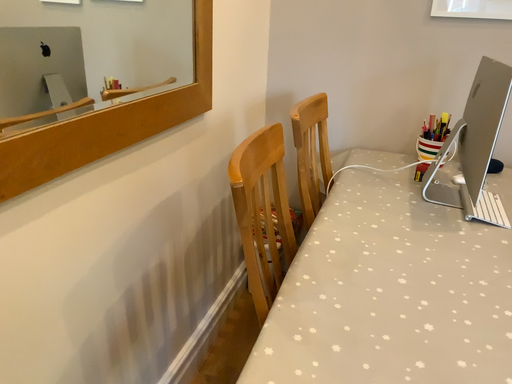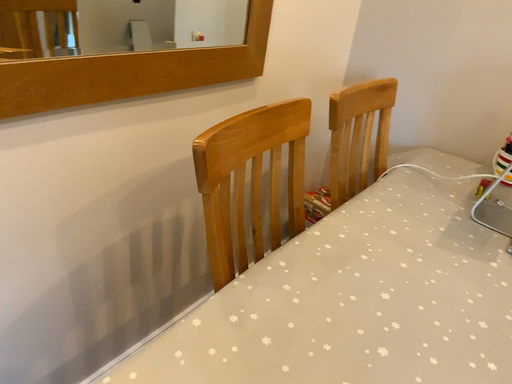
Question: Which way did the camera rotate in the video?

Choices:
 (A) rotated left
 (B) rotated right

Answer: (A)